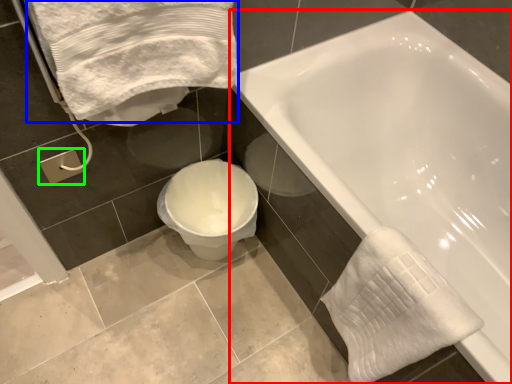
Question: Which object is positioned closest to bathtub (highlighted by a red box)? Select from bath towel (highlighted by a blue box) and towel bar (highlighted by a green box).

Choices:
 (A) bath towel
 (B) towel bar

Answer: (A)